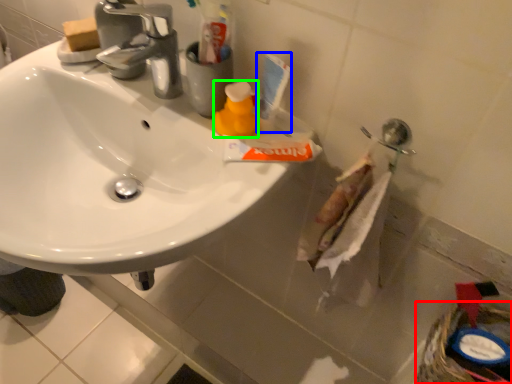
Question: Estimate the real-world distances between objects in this image. Which object is closer to basket (highlighted by a red box), toiletry (highlighted by a blue box) or cleaning product (highlighted by a green box)?

Choices:
 (A) toiletry
 (B) cleaning product

Answer: (A)